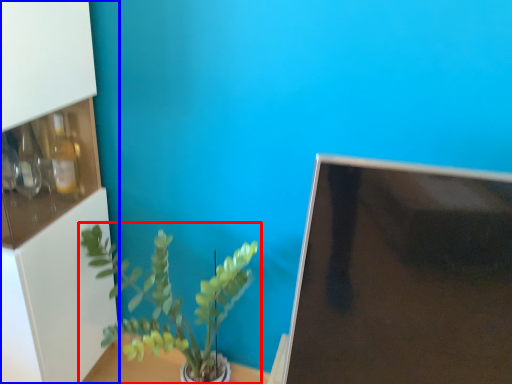
Question: Which object is closer to the camera taking this photo, houseplant (highlighted by a red box) or shelf (highlighted by a blue box)?

Choices:
 (A) houseplant
 (B) shelf

Answer: (B)